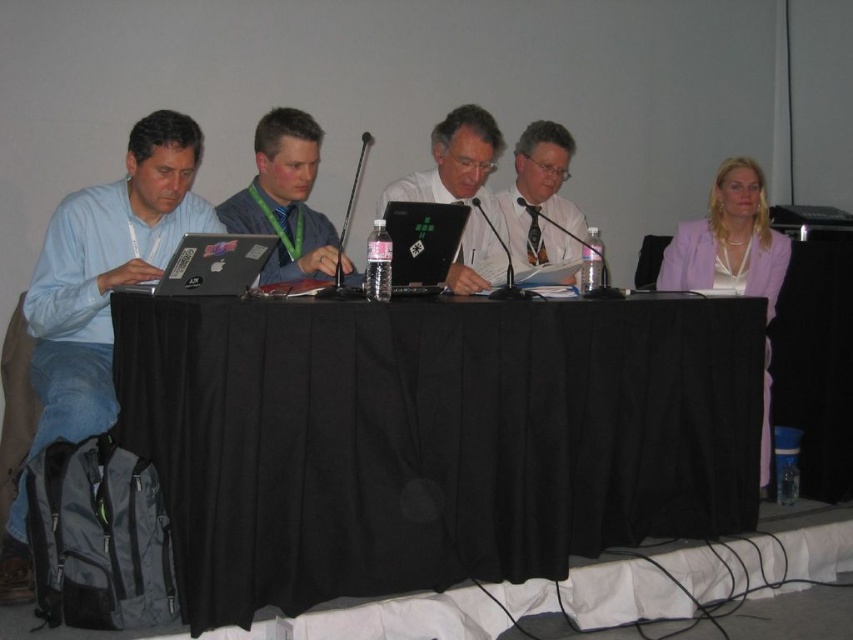
Between black fabric table at center and matte blue shirt at left, which one appears on the left side from the viewer's perspective?

matte blue shirt at left

Between point (735, 452) and point (131, 275), which one is positioned behind?

The point (735, 452) is more distant.

Locate an element on the screen. The width and height of the screenshot is (853, 640). black fabric table at center is located at coordinates (431, 436).

Is black fabric table at center wider than matte black laptop at left?

Yes, black fabric table at center is wider than matte black laptop at left.

What do you see at coordinates (431, 436) in the screenshot? I see `black fabric table at center` at bounding box center [431, 436].

Locate an element on the screen. Image resolution: width=853 pixels, height=640 pixels. black fabric table at center is located at coordinates (431, 436).

What do you see at coordinates (285, 198) in the screenshot? Image resolution: width=853 pixels, height=640 pixels. I see `matte blue shirt at center` at bounding box center [285, 198].

Is matte blue shirt at center positioned before matte white shirt at center?

Yes, matte blue shirt at center is closer to the viewer.

This screenshot has height=640, width=853. What are the coordinates of `matte blue shirt at center` in the screenshot? It's located at (285, 198).

The image size is (853, 640). Find the location of `matte blue shirt at center`. matte blue shirt at center is located at coordinates (285, 198).